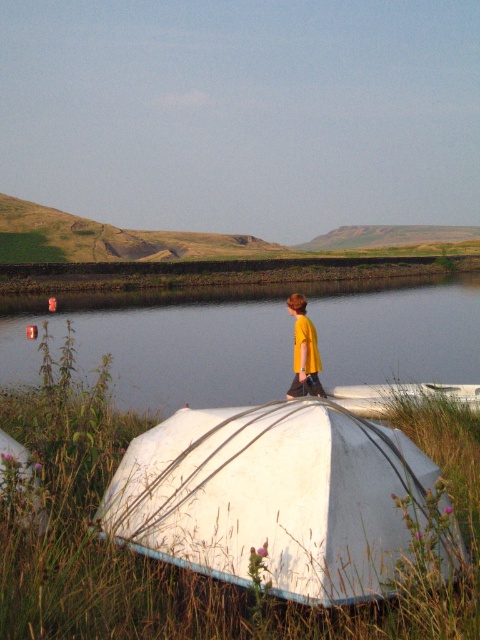
Question: Can you confirm if transparent water at boat right is smaller than yellow fabric shirt at center?

Choices:
 (A) no
 (B) yes

Answer: (A)

Question: Which object appears closest to the camera in this image?

Choices:
 (A) white fabric boat at lower center
 (B) transparent water at boat right
 (C) yellow fabric shirt at center

Answer: (A)

Question: Which of these objects is positioned farthest from the white fabric boat at lower center?

Choices:
 (A) yellow fabric shirt at center
 (B) transparent water at boat right

Answer: (B)

Question: Which of the following is the closest to the observer?

Choices:
 (A) (8, 314)
 (B) (297, 368)

Answer: (B)

Question: Is white fabric boat at lower center wider than yellow fabric shirt at center?

Choices:
 (A) yes
 (B) no

Answer: (A)

Question: Is the position of white fabric boat at lower center more distant than that of yellow fabric shirt at center?

Choices:
 (A) yes
 (B) no

Answer: (B)